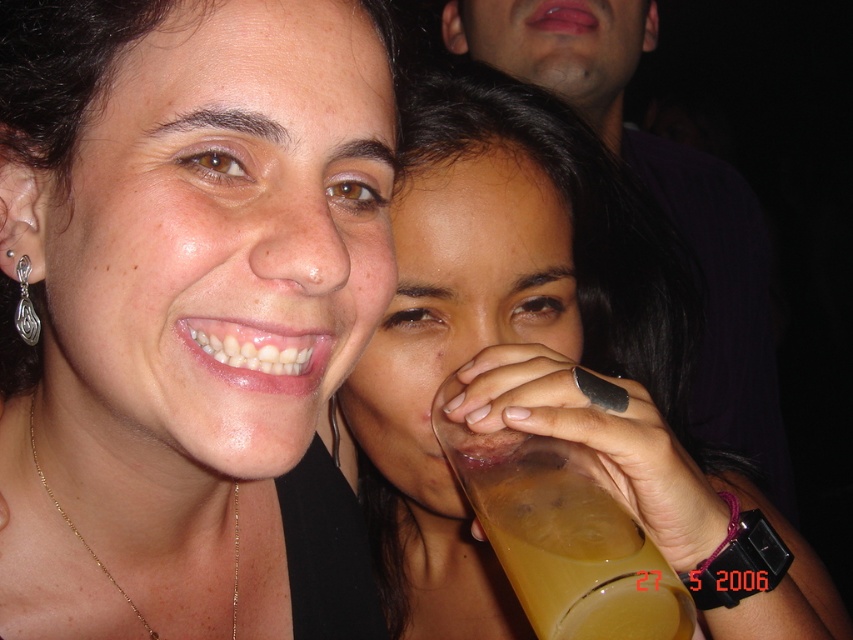
You are at a party and see the translucent plastic cup at center and the translucent yellow liquid at hand right. Which object is located higher in the image?

The translucent plastic cup at center is above the translucent yellow liquid at hand right, so it is located higher in the image.

You are taking a photo of two points in the image. The first point is at coordinate point [578,570] and the second point is at coordinate point [32,451]. Which point is closer to the camera?

Point [578,570] is closer to the camera than point [32,451].

You are standing in a social gathering and see two points in the image, point (102,67) and point (674,376). Which point is closer to you?

Point (102,67) is closer to the viewer than point (674,376).